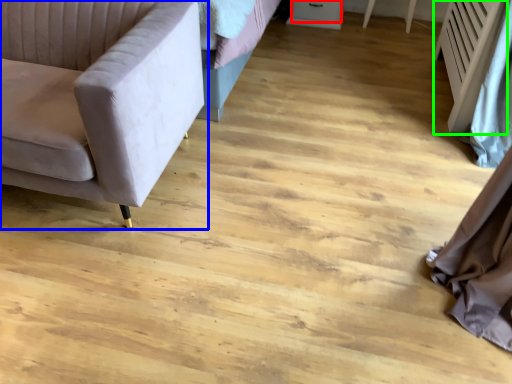
Question: Which object is the farthest from drawer (highlighted by a red box)? Choose among these: studio couch (highlighted by a blue box) or radiator (highlighted by a green box).

Choices:
 (A) studio couch
 (B) radiator

Answer: (A)